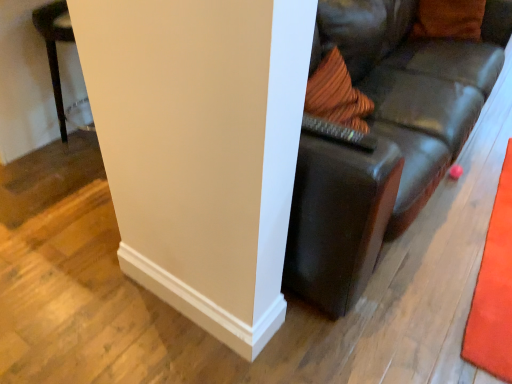
Question: From a real-world perspective, is leather couch at center physically located above or below orange carpet at right?

Choices:
 (A) below
 (B) above

Answer: (A)

Question: Is leather couch at center wider or thinner than orange carpet at right?

Choices:
 (A) thin
 (B) wide

Answer: (B)

Question: Based on their relative distances, which object is farther from the orange fabric pillow at upper right?

Choices:
 (A) orange carpet at right
 (B) leather couch at center
 (C) white smooth wall at center

Answer: (C)

Question: Based on their relative distances, which object is farther from the orange carpet at right?

Choices:
 (A) white smooth wall at center
 (B) leather couch at center
 (C) orange fabric pillow at upper right

Answer: (C)